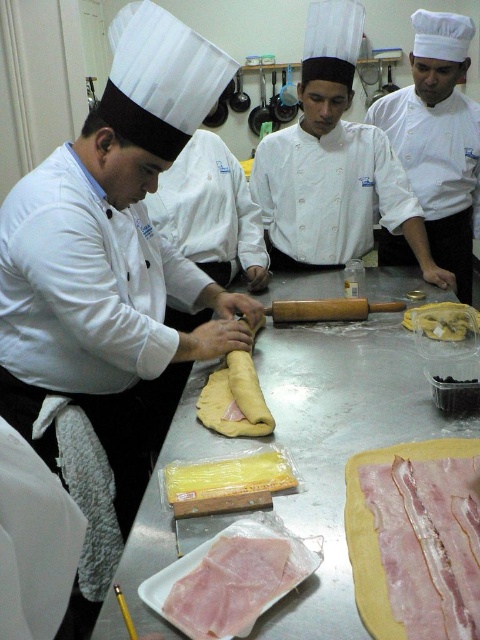
What is located at the point with coordinates (428, 544) in the image?

The point with coordinates (428, 544) corresponds to pink glossy bacon at center.

You are a chef in the kitchen. You need to grab the wooden rolling pin at center to roll out the dough. Where should you look relative to the pink glossy bacon at center?

The wooden rolling pin at center is above the pink glossy bacon at center, so you should look above the pink glossy bacon at center to find it.